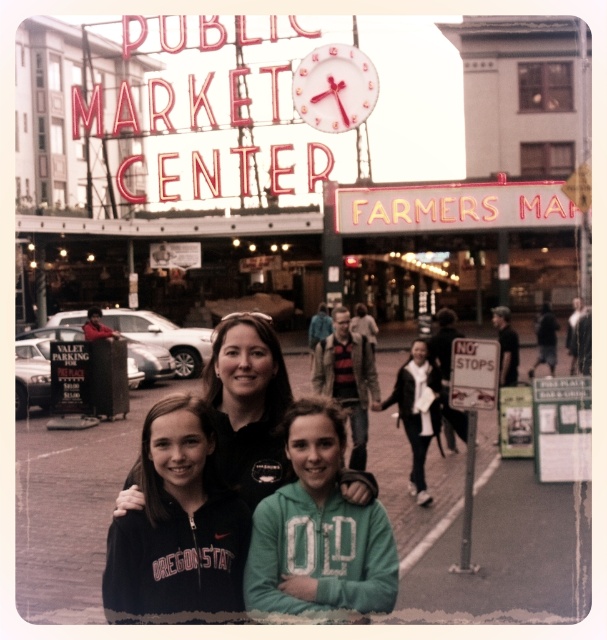
You are a photographer trying to capture the iconic Public Market Center sign in the background while focusing on the black fleece jacket at center. Based on their positions, can you estimate where the jacket is placed in the frame?

The black fleece jacket at center is located at the 2D coordinates point (177, 522) in the frame.